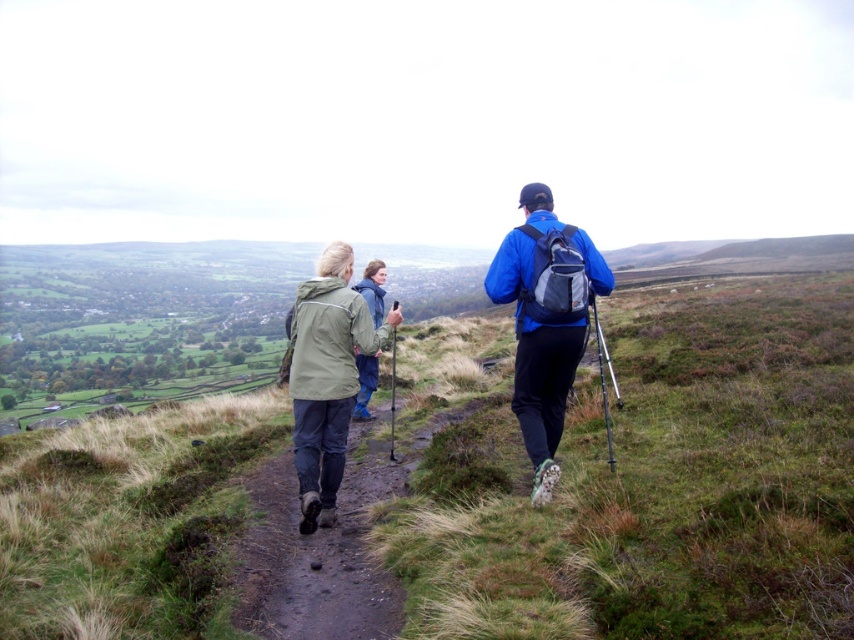
From the picture: You are a hiker planning to walk through the grassy area in the image. The path is between the green grassy at center and the blue matte jacket at center. Which direction should you walk to avoid the taller grass?

To avoid the taller grass, you should walk towards the blue matte jacket at center because the green grassy at center is much taller than the blue matte jacket at center, indicating shorter grass near the jacket.

You are planning to join the hikers on the grassy path. You need to know which hiker is wider in size between the blue matte jacket at center and the green matte jacket at center to choose the appropriate spot to walk. Which hiker has a wider width?

The blue matte jacket at center has a larger width than the green matte jacket at center according to the description.

You are a hiker trying to cross the path. The path is covered with green grassy at center and green matte jacket at center. Which one has a wider area?

The green grassy at center has a wider area than the green matte jacket at center.